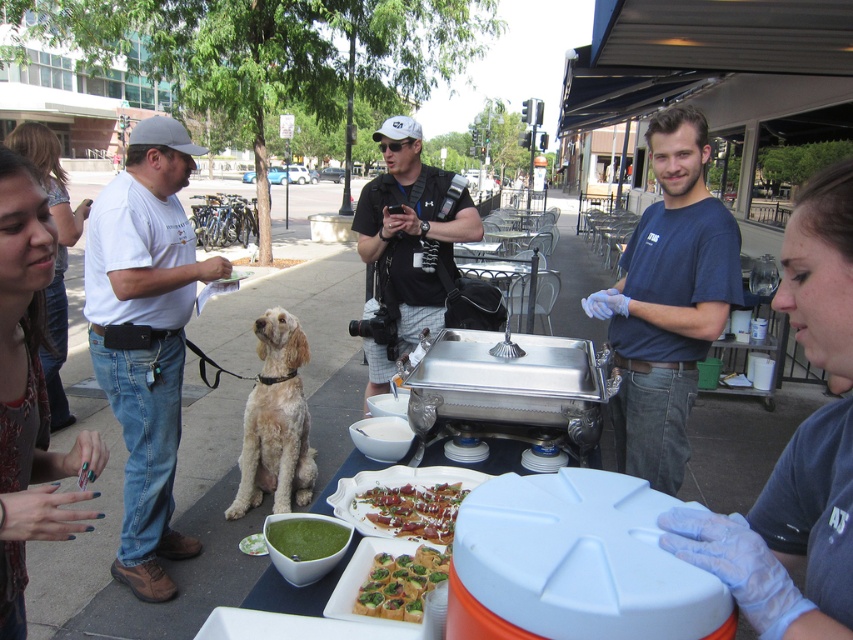
You are at the outdoor event and want to know which of the two points, point (654,262) or point (300,467), is closer to you. Can you determine this based on the scene?

Point (654,262) is closer to the viewer than point (300,467).

You are a photographer at the event and want to capture both the blue cotton shirt at center and the fuzzy beige dog at center in a single photo. Which object should you focus on first to ensure both are in frame?

You should focus on the blue cotton shirt at center first since it is larger in size than the fuzzy beige dog at center, allowing you to frame it properly while still including the smaller dog in the shot.

You are a photographer trying to capture a photo of the fuzzy beige dog at center and the matte black shirt at upper left in the same frame. Given that your camera has a maximum focus range of 4 feet, will you be able to include both subjects in the photo without moving the camera?

The fuzzy beige dog at center and the matte black shirt at upper left are 4.10 feet apart, which exceeds the camera focus range of 4 feet. Therefore, you cannot include both subjects in the same frame without moving the camera.